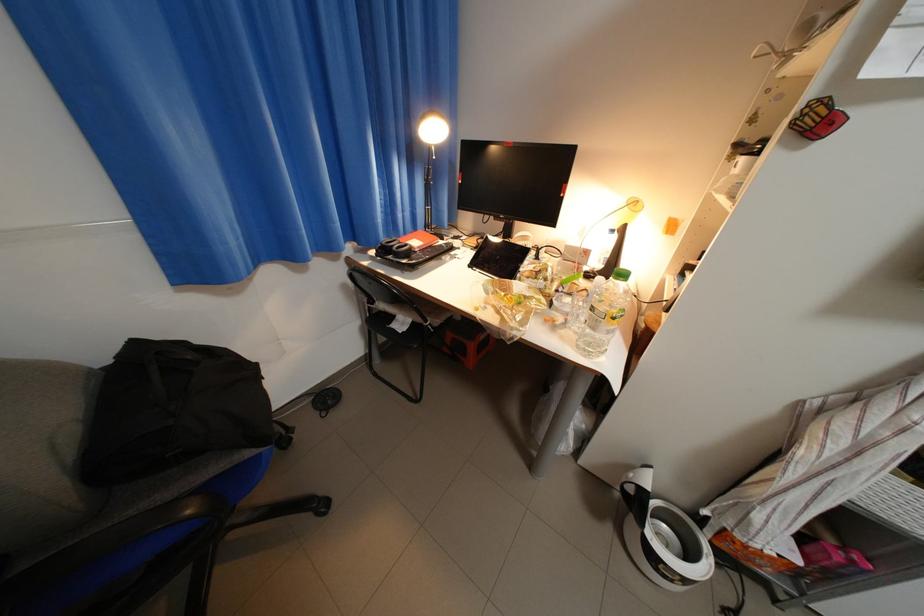
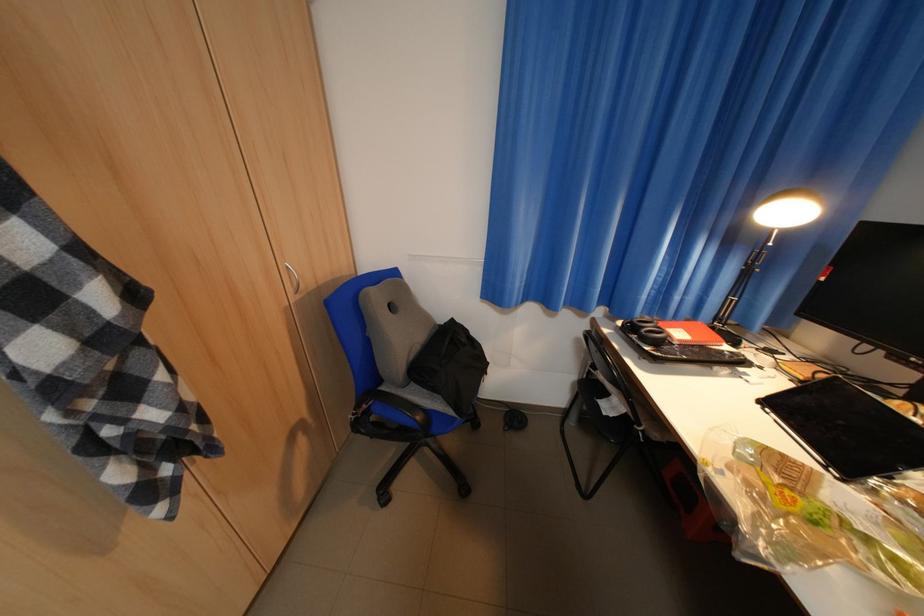
Question: Based on the continuous images, in which direction is the camera rotating? Reply with the corresponding letter.

Choices:
 (A) Left
 (B) Right
 (C) Up
 (D) Down

Answer: (A)